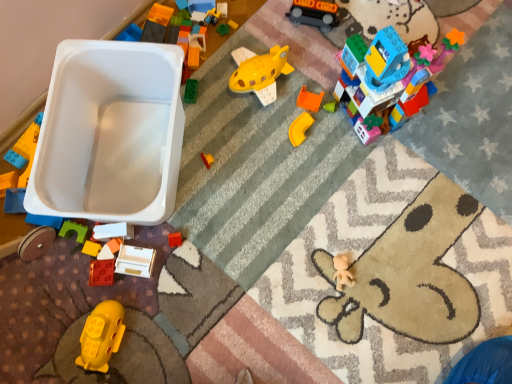
Where is `vacant space behind yellow matte toy submarine at lower left, which is the first toy from bottom to top`? This screenshot has height=384, width=512. vacant space behind yellow matte toy submarine at lower left, which is the first toy from bottom to top is located at coordinates (101, 269).